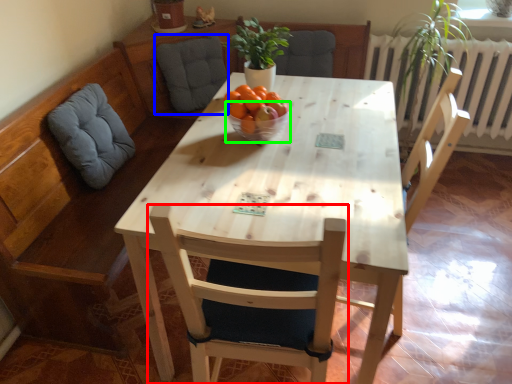
Question: Which object is the farthest from chair (highlighted by a red box)? Choose among these: swivel chair (highlighted by a blue box) or glass bowl (highlighted by a green box).

Choices:
 (A) swivel chair
 (B) glass bowl

Answer: (A)